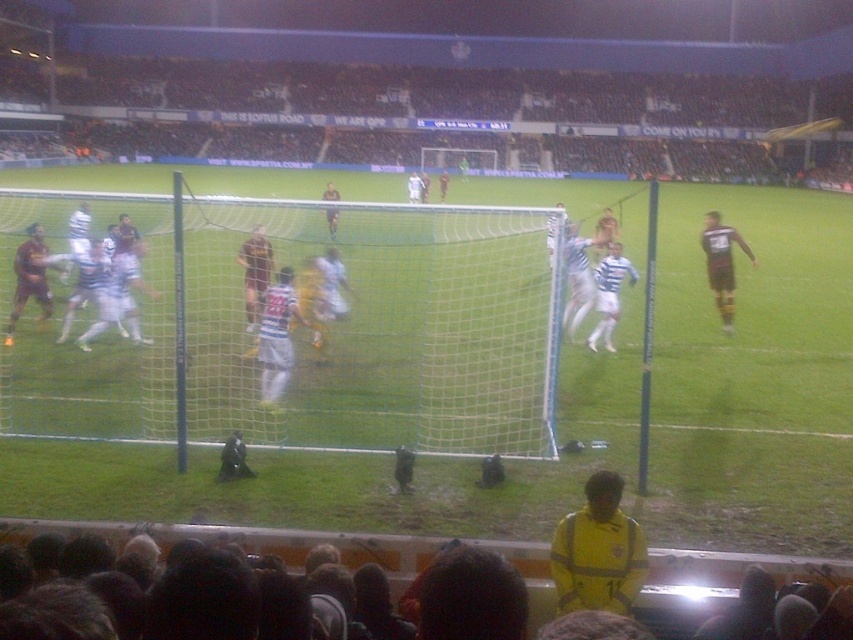
Question: Is dark brown jersey at center in front of yellow jersey at center?

Choices:
 (A) yes
 (B) no

Answer: (A)

Question: Which object is farther from the camera taking this photo?

Choices:
 (A) yellow jersey at lower center
 (B) striped jersey at center
 (C) dark brown jersey at left

Answer: (C)

Question: Which point is closer to the camera taking this photo?

Choices:
 (A) (250, 266)
 (B) (743, 250)
 (C) (376, 556)
 (D) (596, 284)

Answer: (C)

Question: Estimate the real-world distances between objects in this image. Which object is farther from the brown jersey at right?

Choices:
 (A) white matte jersey at center
 (B) yellow jersey at lower center

Answer: (B)

Question: Where is dark brown jersey at left located in relation to yellow jersey at center in the image?

Choices:
 (A) right
 (B) left

Answer: (B)

Question: Is dark hair at lower center positioned at the back of yellow jersey at lower center?

Choices:
 (A) no
 (B) yes

Answer: (B)